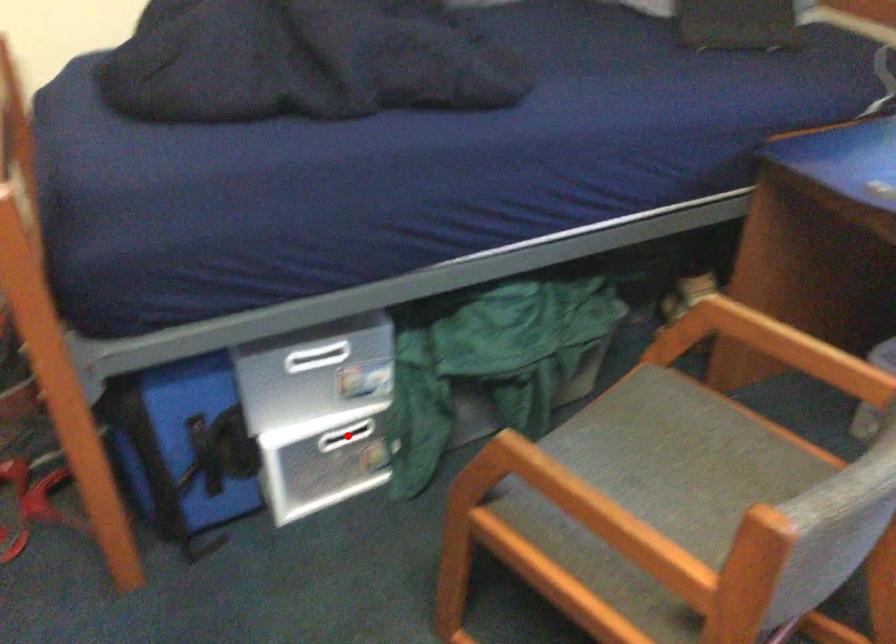
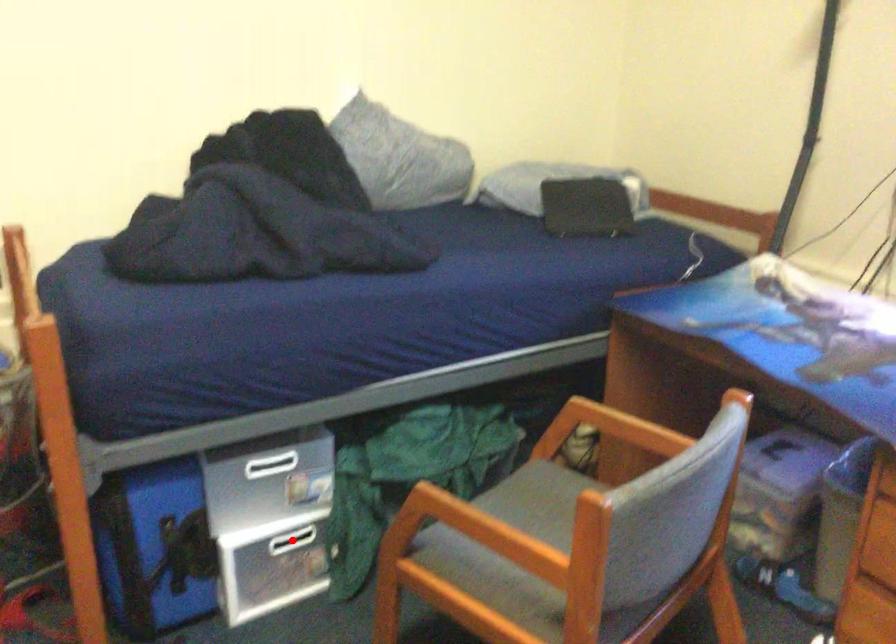
I am providing you with two images of the same scene from different viewpoints. A red point is marked on the first image and another point is marked on the second image. Are the points marked in image1 and image2 representing the same 3D position?

Yes